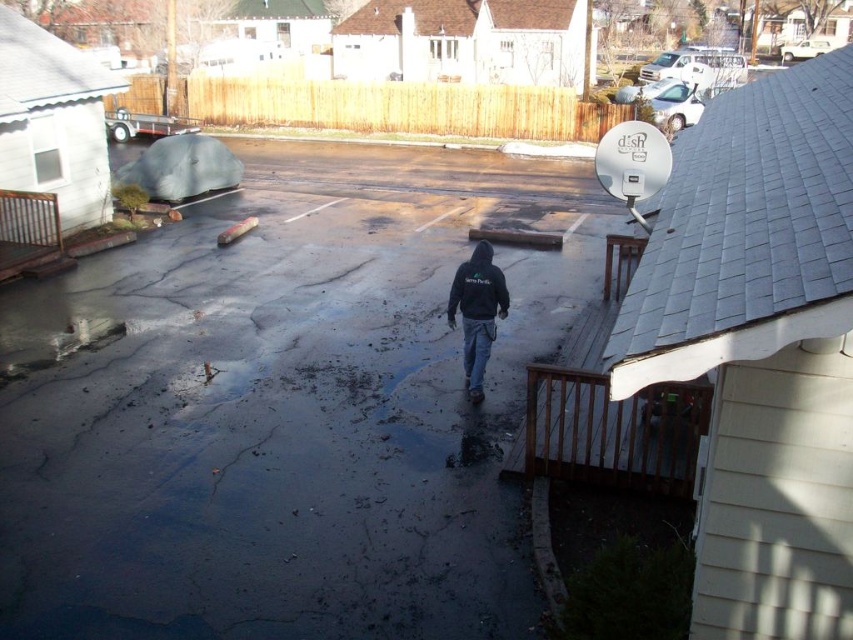
How much distance is there between black hoodie at center and black fleece sweatshirt at center?

black hoodie at center and black fleece sweatshirt at center are 5.99 inches apart from each other.

Between black hoodie at center and black fleece sweatshirt at center, which one has less height?

black fleece sweatshirt at center

You are a GUI agent. You are given a task and a screenshot of the screen. Output one action in this format:
    pyautogui.click(x=<x>, y=<y>)
    Task: Click on the black hoodie at center
    The image size is (853, 640).
    Given the screenshot: What is the action you would take?
    pyautogui.click(x=477, y=310)

Is wooden at lower right below black fleece sweatshirt at center?

Correct, wooden at lower right is located below black fleece sweatshirt at center.

Does point (691, 467) come closer to viewer compared to point (476, 308)?

That is True.

You are a GUI agent. You are given a task and a screenshot of the screen. Output one action in this format:
    pyautogui.click(x=<x>, y=<y>)
    Task: Click on the wooden at lower right
    The height and width of the screenshot is (640, 853).
    Given the screenshot: What is the action you would take?
    pyautogui.click(x=608, y=408)

Measure the distance between black hoodie at center and camera.

black hoodie at center and camera are 8.27 meters apart.

Find the location of a particular element. black hoodie at center is located at coordinates (477, 310).

Identify the location of black hoodie at center. (477, 310).